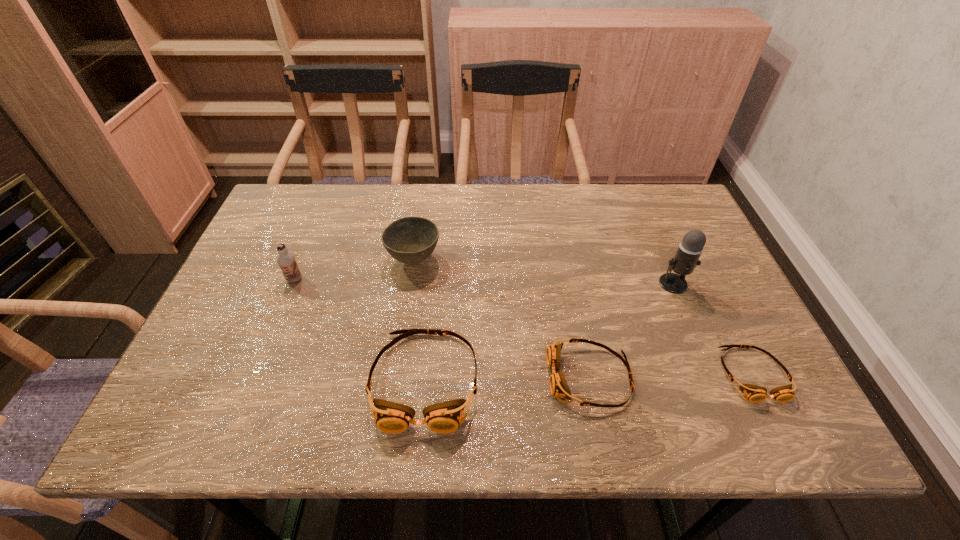
Where is `free space in the image that satisfies the following two spatial constraints: 1. with the lenses facing forward on the shortest object; 2. with the lenses facing forward on the second shortest object`? This screenshot has width=960, height=540. free space in the image that satisfies the following two spatial constraints: 1. with the lenses facing forward on the shortest object; 2. with the lenses facing forward on the second shortest object is located at coordinates (754, 377).